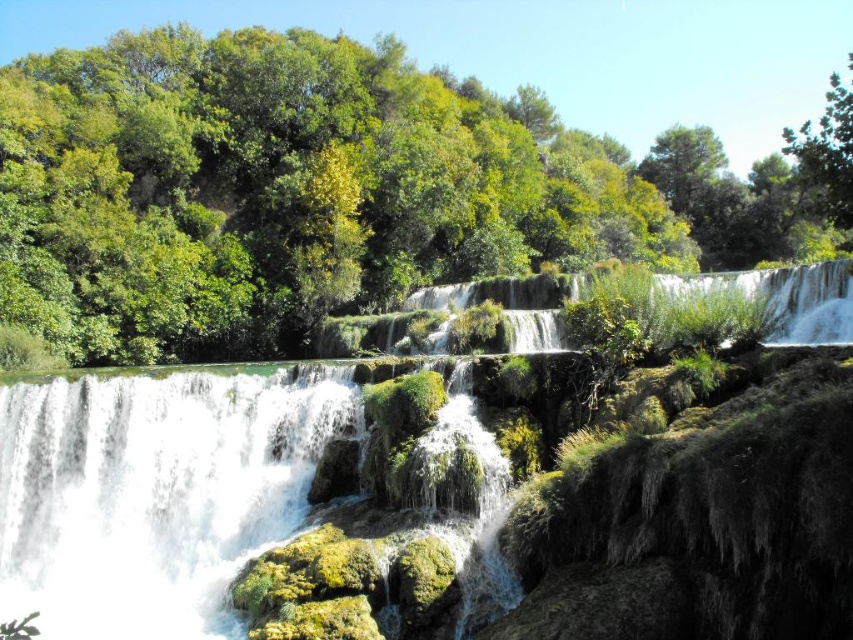
You are a hiker standing at the base of the waterfall and want to take a photo of both the white frothy water at center and the green leafy tree at upper right. Which object should you focus on first if you want to capture both in the same frame without moving your camera?

You should focus on the white frothy water at center first because it is closer to you than the green leafy tree at upper right, which is further away. This way, both objects will be in the same frame without needing to adjust the camera position.

You are a hiker standing at the base of the green leafy tree at upper center. You want to reach the green leafy tree at upper right. If your average walking speed is 1.5 meters per second, how many seconds will it take you to walk directly between the two trees?

The distance between the green leafy tree at upper center and the green leafy tree at upper right is 43.84 meters. At a walking speed of 1.5 meters per second, dividing the distance by the speed gives 43.84 divided by 1.5, which equals approximately 29.23 seconds. Therefore, it will take roughly 29 seconds to walk directly between the two trees.